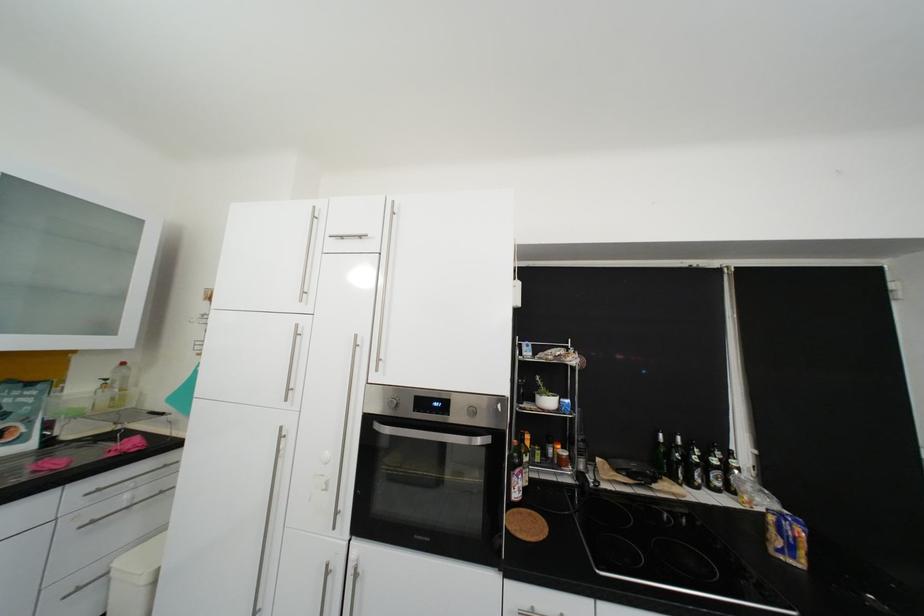
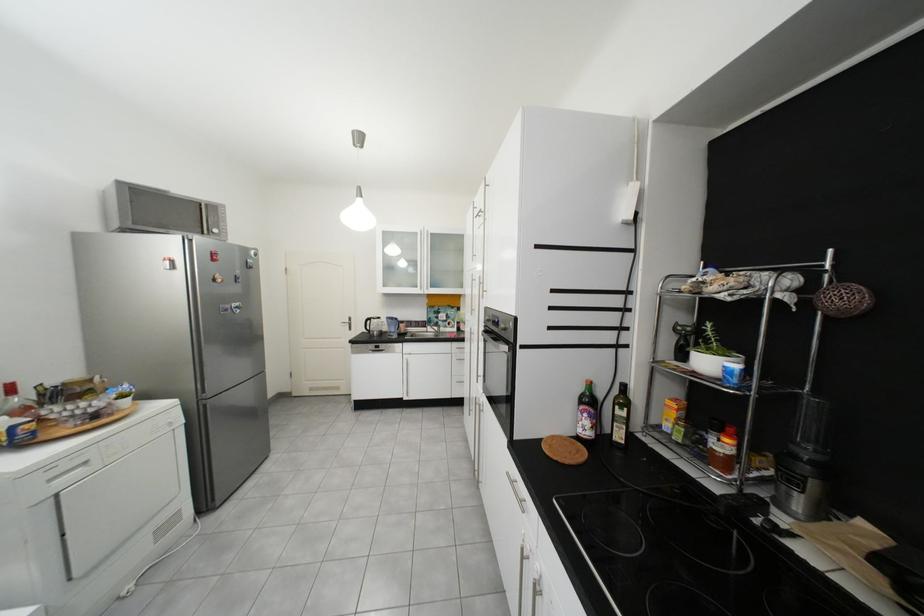
Locate, in the second image, the point that corresponds to (x=293, y=439) in the first image.

(482, 334)